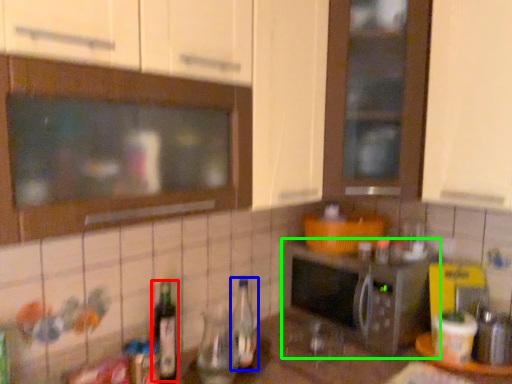
Question: Which object is positioned farthest from bottle (highlighted by a red box)? Select from bottle (highlighted by a blue box) and microwave oven (highlighted by a green box).

Choices:
 (A) bottle
 (B) microwave oven

Answer: (B)